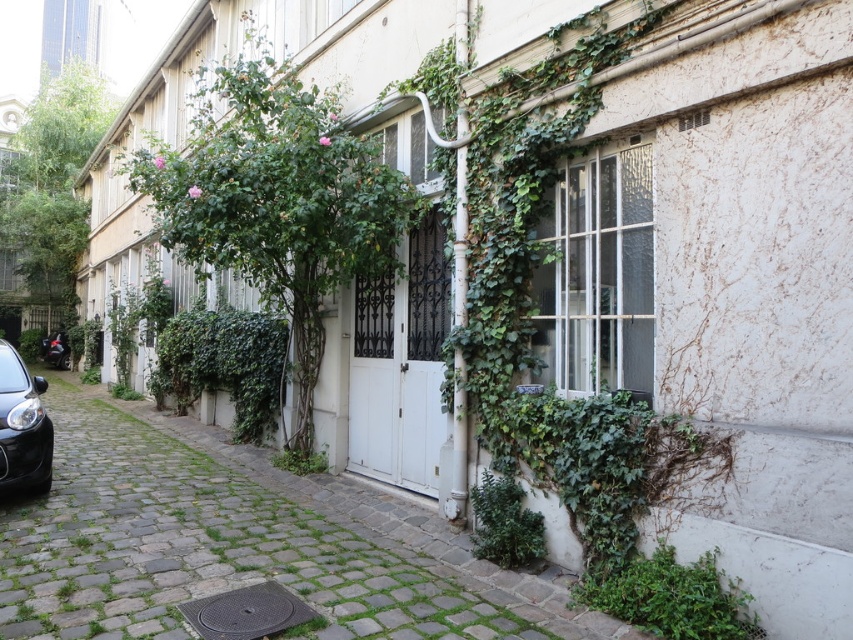
You are standing at the entrance of the alleyway and see the point marked at coordinates (505, 524). What object is located at that point?

The point at coordinates (505, 524) marks a green leafy bush at lower center.

You are a gardener planning to trim the bushes in the alleyway. You see the green leafy bush at lower right and the green leafy bush at lower center. Which bush should you prioritize trimming if you want to maintain a uniform height between them?

The green leafy bush at lower right is shorter than the green leafy bush at lower center, so you should prioritize trimming the taller green leafy bush at lower center to achieve uniformity.

You are a gardener who needs to water both the green leafy bush at lower center and the green leafy plant at center. Which one should you water first if you want to start from the lowest point in the alleyway?

The green leafy plant at center should be watered first because it is located below the green leafy bush at lower center, so starting from the lowest point would mean addressing the lower one first.